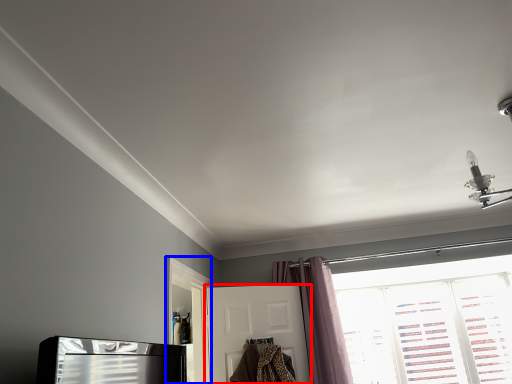
Question: Which object is closer to the camera taking this photo, door (highlighted by a red box) or screen door (highlighted by a blue box)?

Choices:
 (A) door
 (B) screen door

Answer: (B)